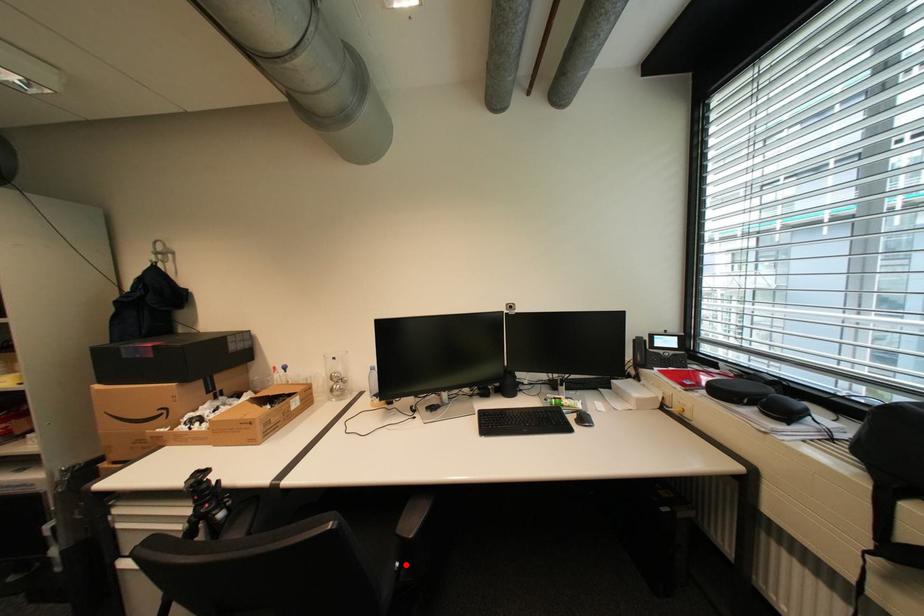
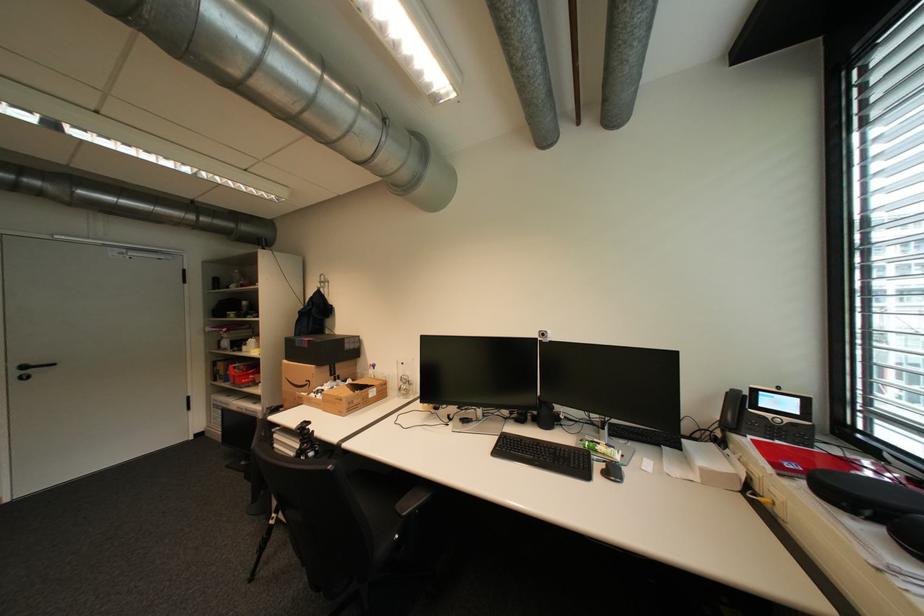
Locate, in the second image, the point that corresponds to the highlighted location in the first image.

(406, 537)